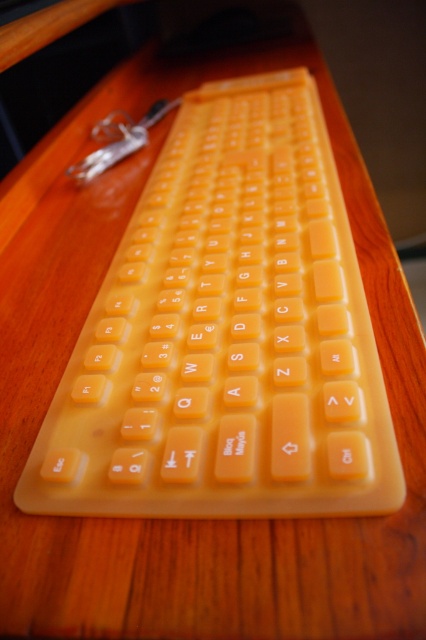
Is point (123, 444) positioned before point (178, 102)?

Yes, it is in front of point (178, 102).

Locate an element on the screen. Image resolution: width=426 pixels, height=640 pixels. yellow rubber keyboard at center is located at coordinates [x=227, y=333].